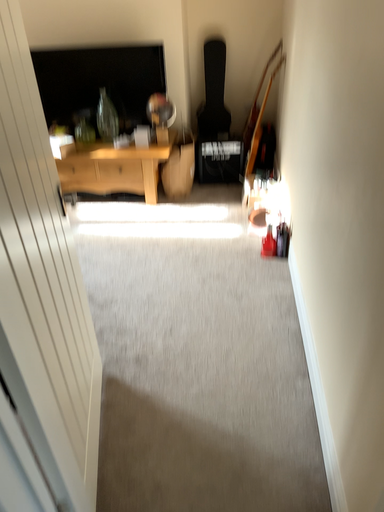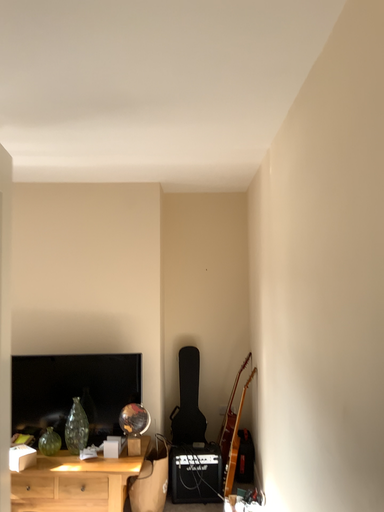
Question: How did the camera likely rotate when shooting the video?

Choices:
 (A) rotated downward
 (B) rotated upward

Answer: (B)